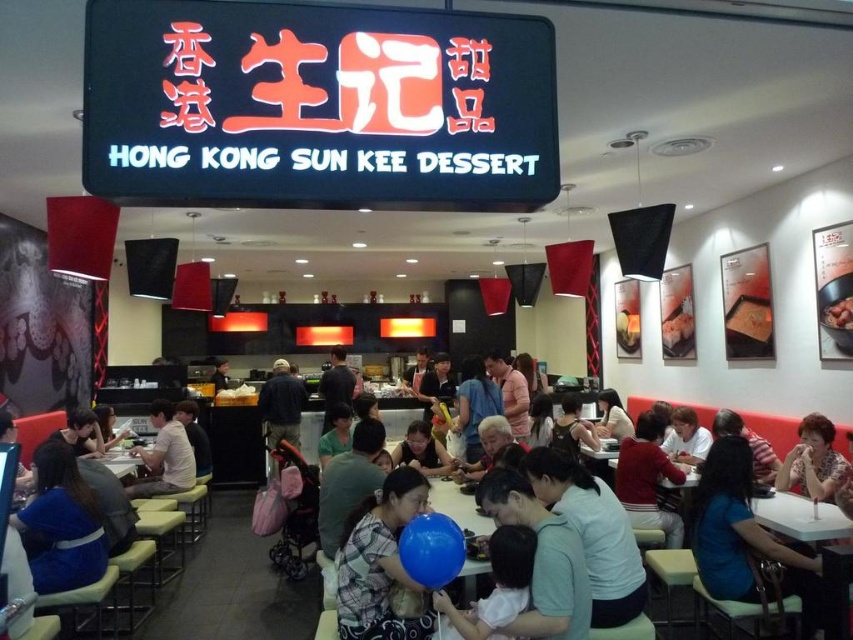
Question: Which object is positioned farthest from the white plastic table at lower left?

Choices:
 (A) brown glossy dessert at center
 (B) blue fabric shirt at lower right
 (C) light pink shirt at center
 (D) red sweater at center

Answer: (A)

Question: Is light pink shirt at center to the left of white plastic table at lower left from the viewer's perspective?

Choices:
 (A) no
 (B) yes

Answer: (A)

Question: Which of the following is the closest to the observer?

Choices:
 (A) plaid fabric shirt at lower center
 (B) white plastic table at lower left
 (C) blue fabric shirt at lower right
 (D) red sweater at center

Answer: (A)

Question: Where is blue fabric shirt at lower right located in relation to light pink shirt at center in the image?

Choices:
 (A) right
 (B) left

Answer: (A)

Question: Which object is farther from the camera taking this photo?

Choices:
 (A) blue fabric shirt at lower right
 (B) light pink shirt at center
 (C) red sweater at center

Answer: (B)

Question: Is blue cotton shirt at lower left below red sweater at center?

Choices:
 (A) yes
 (B) no

Answer: (B)